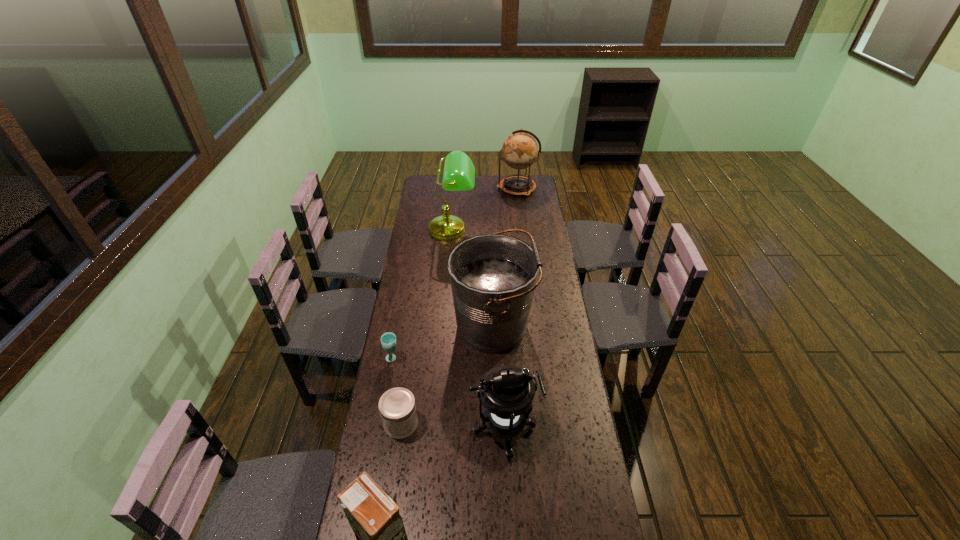
The height and width of the screenshot is (540, 960). I want to click on vacant space that satisfies the following two spatial constraints: 1. on the desk next to the bucket; 2. on the right side of the second farthest object, so click(x=444, y=326).